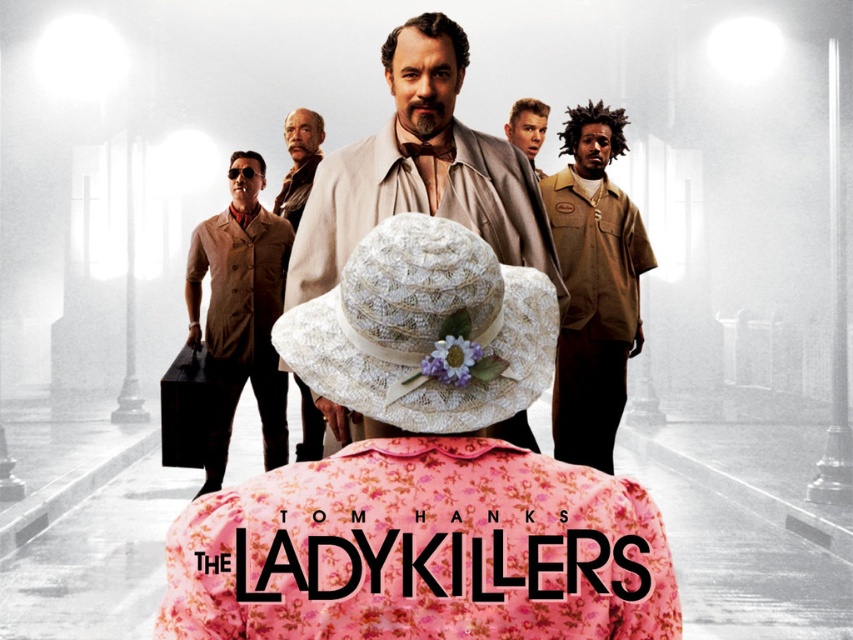
Question: Which object appears closest to the camera in this image?

Choices:
 (A) beige wool coat at center
 (B) brown leather vest at left
 (C) brown leather jacket at center

Answer: (A)

Question: Can you confirm if brown leather vest at left is positioned below smooth brown suit at center?

Choices:
 (A) yes
 (B) no

Answer: (A)

Question: Which object is farther from the camera taking this photo?

Choices:
 (A) smooth brown leather jacket at center
 (B) floral fabric hat at center
 (C) beige wool coat at center

Answer: (A)

Question: Is floral fabric hat at center to the left of brown fabric shirt at right from the viewer's perspective?

Choices:
 (A) yes
 (B) no

Answer: (A)

Question: Estimate the real-world distances between objects in this image. Which object is farther from the smooth brown suit at center?

Choices:
 (A) beige wool coat at center
 (B) smooth brown leather jacket at center

Answer: (A)

Question: Is brown leather vest at left below smooth brown suit at center?

Choices:
 (A) yes
 (B) no

Answer: (A)